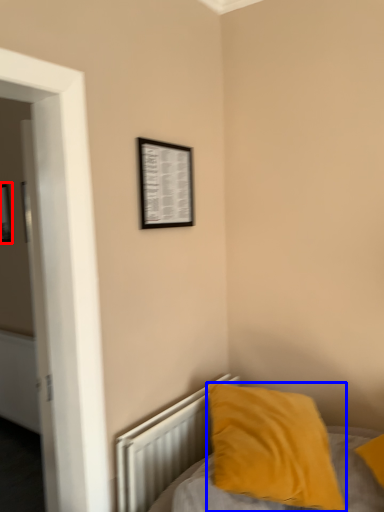
Question: Which point is closer to the camera, picture frame (highlighted by a red box) or pillow (highlighted by a blue box)?

Choices:
 (A) picture frame
 (B) pillow

Answer: (B)